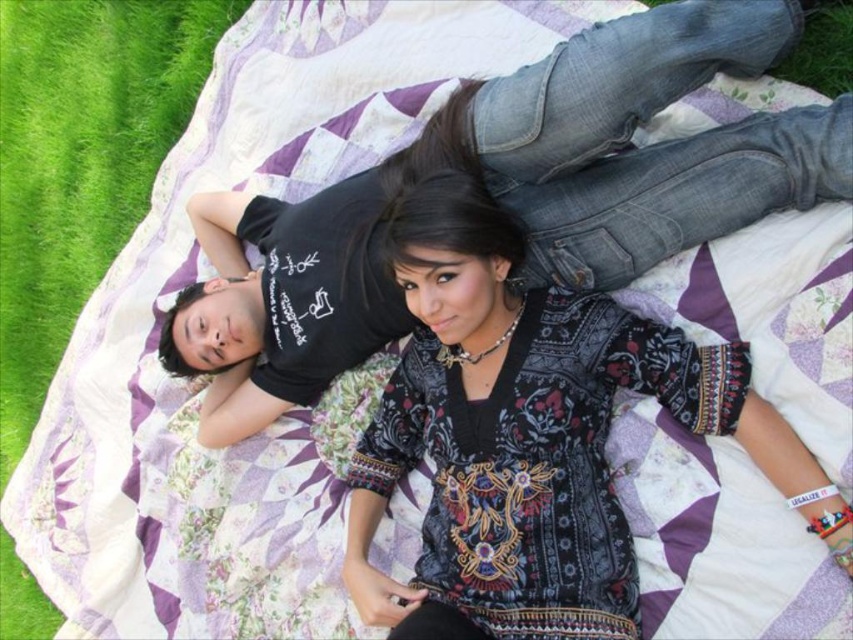
Question: Among these points, which one is nearest to the camera?

Choices:
 (A) (0, 627)
 (B) (488, 324)

Answer: (B)

Question: Is patterned fabric dress at center below green grass at left?

Choices:
 (A) yes
 (B) no

Answer: (A)

Question: Which point is closer to the camera?

Choices:
 (A) (97, 161)
 (B) (392, 436)

Answer: (B)

Question: In this image, where is patterned fabric dress at center located relative to green grass at left?

Choices:
 (A) below
 (B) above

Answer: (A)

Question: Is patterned fabric dress at center to the right of green grass at left from the viewer's perspective?

Choices:
 (A) no
 (B) yes

Answer: (B)